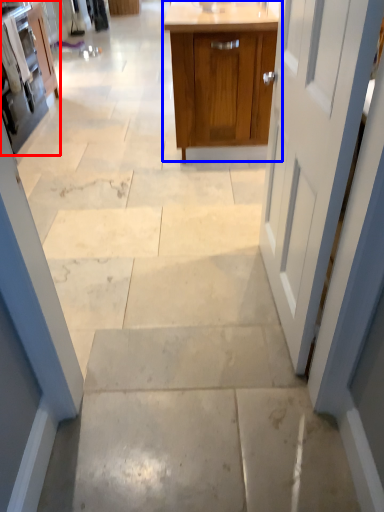
Question: Which of the following is the farthest to the observer, cabinetry (highlighted by a red box) or cabinetry (highlighted by a blue box)?

Choices:
 (A) cabinetry
 (B) cabinetry

Answer: (A)